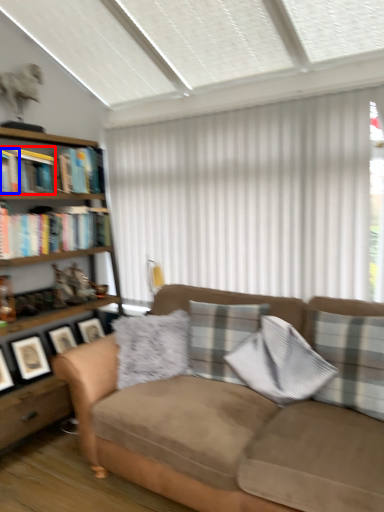
Question: Which object is closer to the camera taking this photo, book (highlighted by a red box) or book (highlighted by a blue box)?

Choices:
 (A) book
 (B) book

Answer: (B)